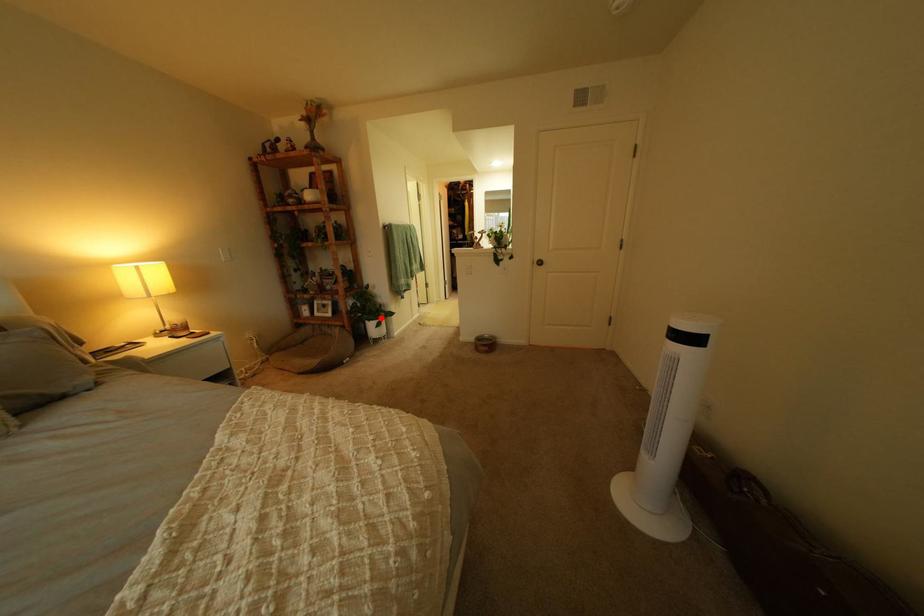
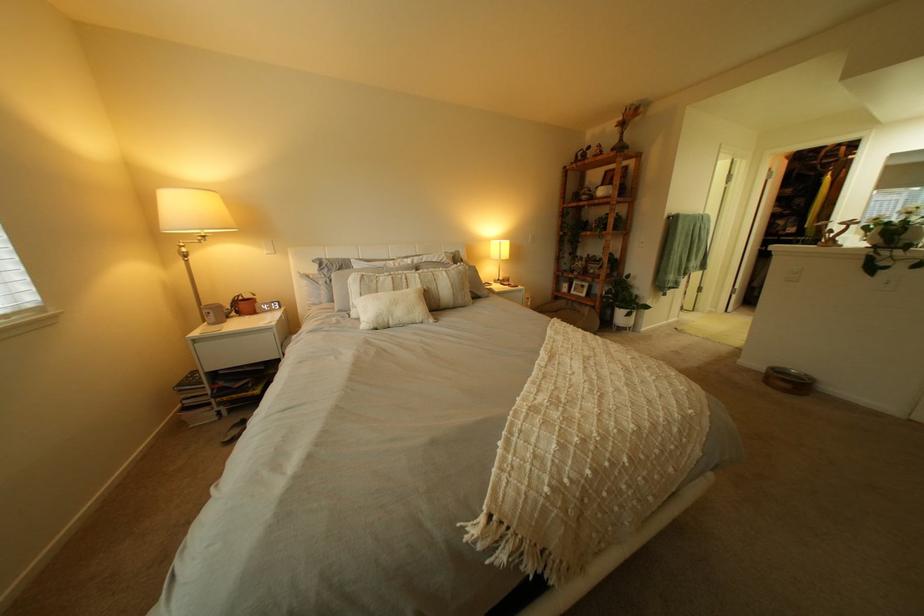
The point at the highlighted location is marked in the first image. Where is the corresponding point in the second image?

(633, 305)